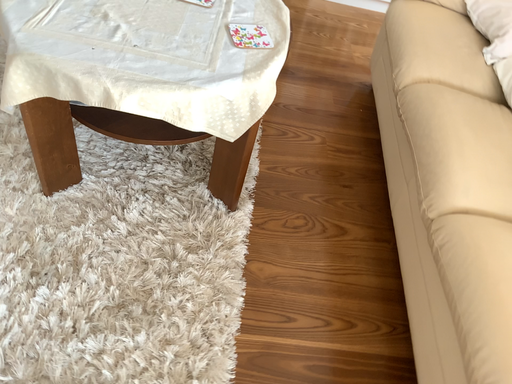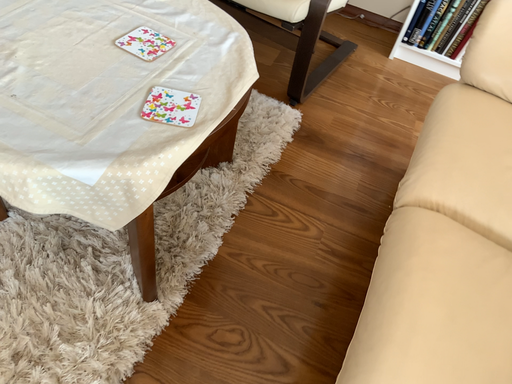
Question: Which way did the camera rotate in the video?

Choices:
 (A) rotated left
 (B) rotated right

Answer: (A)